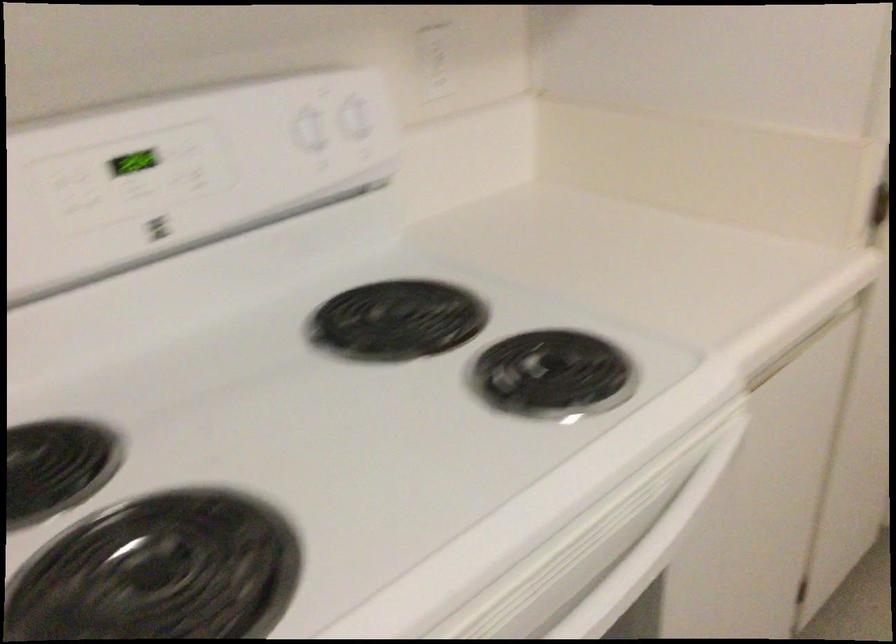
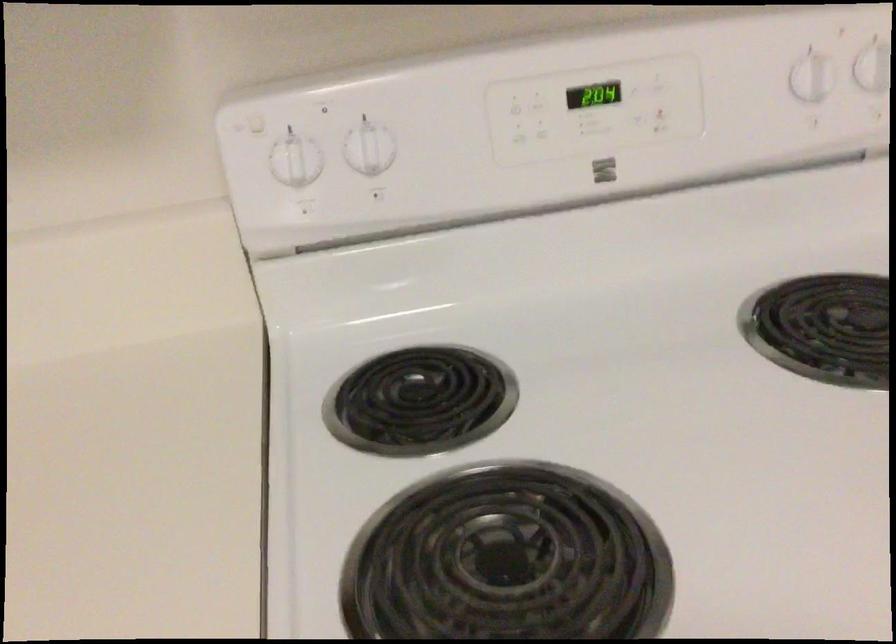
In the second image, find the point that corresponds to (x=69, y=191) in the first image.

(515, 108)